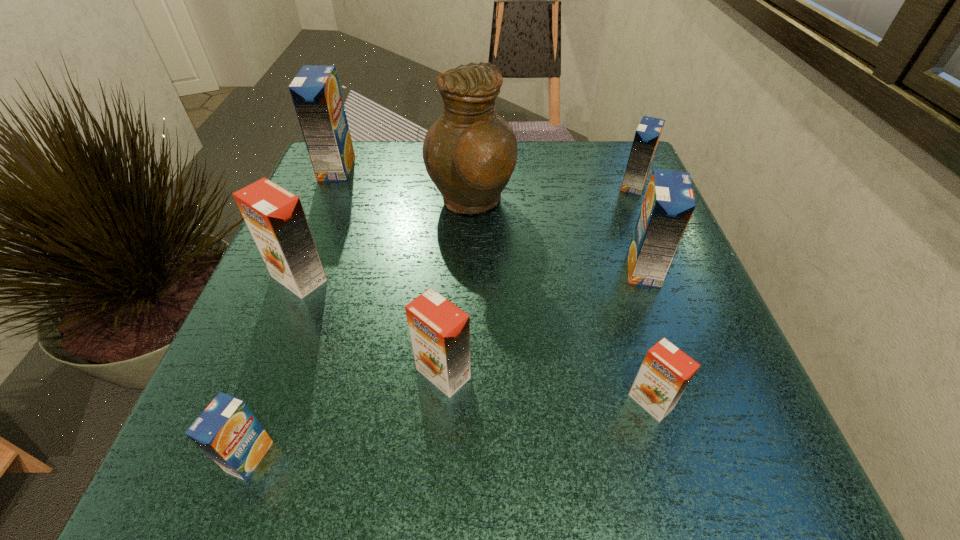
This screenshot has width=960, height=540. Identify the location of the smallest orange orange juice. (666, 371).

Locate an element on the screen. This screenshot has height=540, width=960. the nearest orange_juice is located at coordinates (227, 431).

What are the coordinates of `the smallest blue orange_juice` in the screenshot? It's located at (227, 431).

At what (x,y) coordinates should I click in order to perform the action: click on free region located 0.220m at the spout of the brown pitcher. Please return your answer as a coordinate pair (x, y). This screenshot has width=960, height=540. Looking at the image, I should click on (617, 203).

Identify the location of free space located 0.070m on the front of the seventh shortest object. (324, 200).

Where is `vacant space located on the front of the second nearest blue orange_juice`? The height and width of the screenshot is (540, 960). vacant space located on the front of the second nearest blue orange_juice is located at coordinates (711, 453).

Locate an element on the screen. The height and width of the screenshot is (540, 960). free region located 0.220m on the back of the farthest orange orange juice is located at coordinates pyautogui.click(x=334, y=191).

Find the location of `free space located on the front of the second smallest blue orange_juice`. free space located on the front of the second smallest blue orange_juice is located at coordinates (677, 287).

Find the location of a particular element. This screenshot has width=960, height=540. vacant point located 0.190m on the left of the fourth orange_juice from right to left is located at coordinates (287, 373).

At what (x,y) coordinates should I click in order to perform the action: click on blank area located 0.050m on the back of the smallest orange orange juice. Please return your answer as a coordinate pair (x, y). This screenshot has height=540, width=960. Looking at the image, I should click on (636, 353).